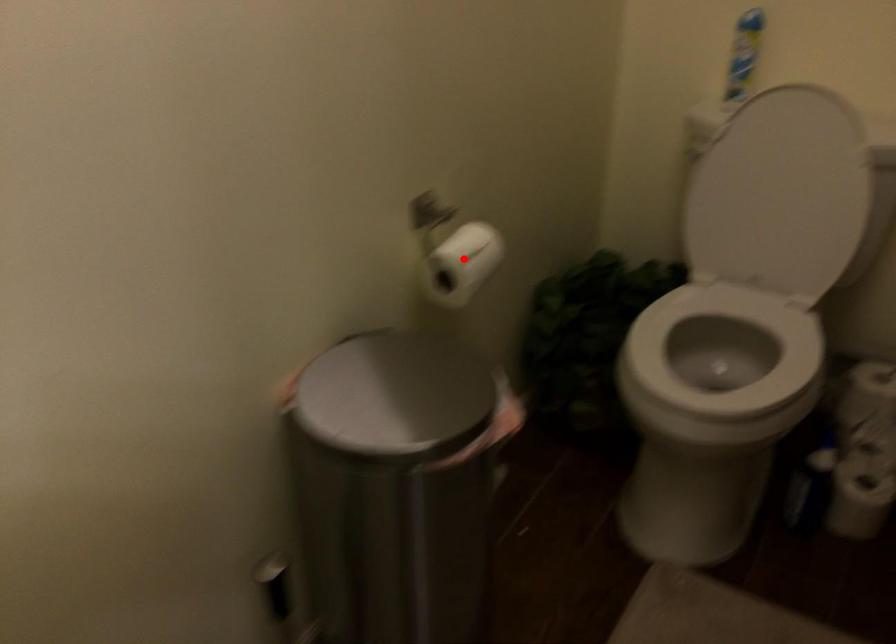
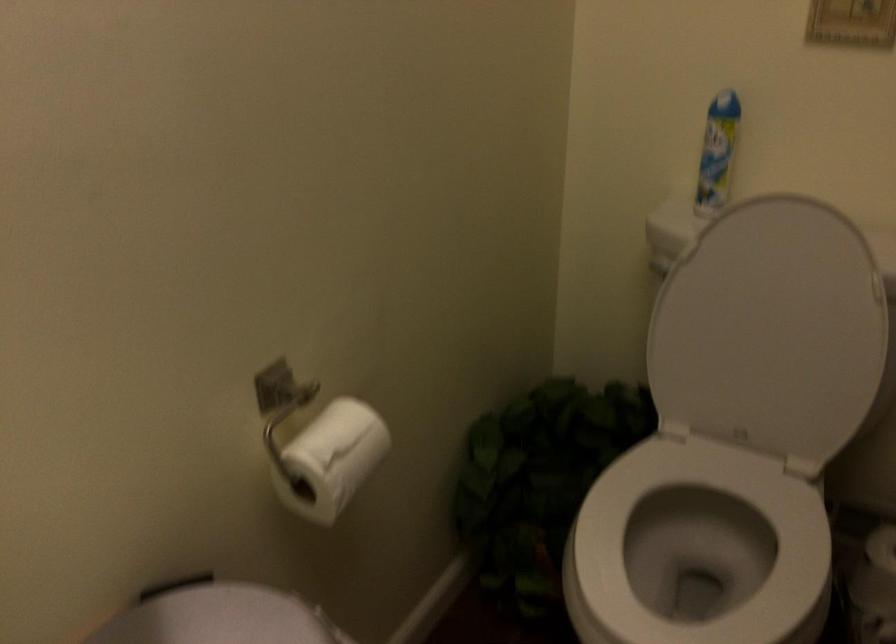
Question: I am providing you with two images of the same scene from different viewpoints. Given a red point in image1, look at the same physical point in image2. Is it:

Choices:
 (A) Closer to the viewpoint
 (B) Farther from the viewpoint

Answer: (A)